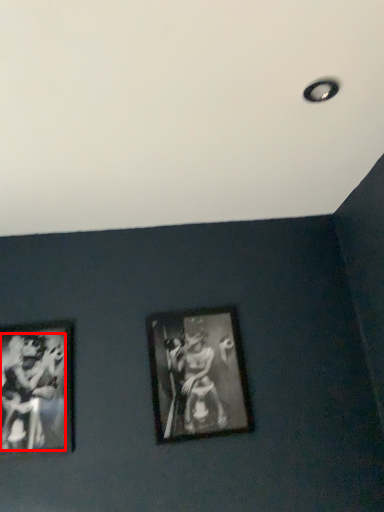
Question: Observing the image, what is the correct spatial positioning of person (annotated by the red box) in reference to picture frame?

Choices:
 (A) right
 (B) left

Answer: (B)